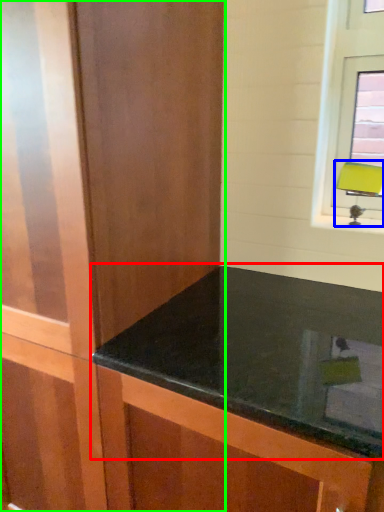
Question: Which is farther away from countertop (highlighted by a red box)? table lamp (highlighted by a blue box) or dresser (highlighted by a green box)?

Choices:
 (A) table lamp
 (B) dresser

Answer: (A)